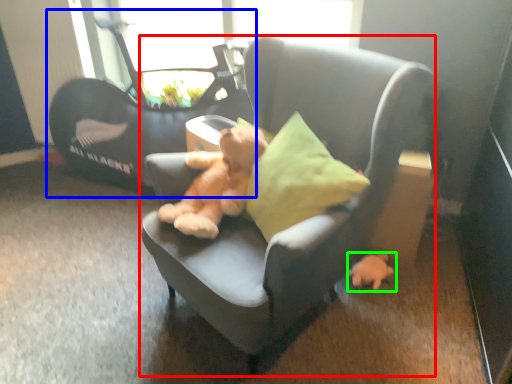
Question: Based on their relative distances, which object is nearer to chair (highlighted by a red box)? Choose from baby carriage (highlighted by a blue box) and toy (highlighted by a green box).

Choices:
 (A) baby carriage
 (B) toy

Answer: (B)